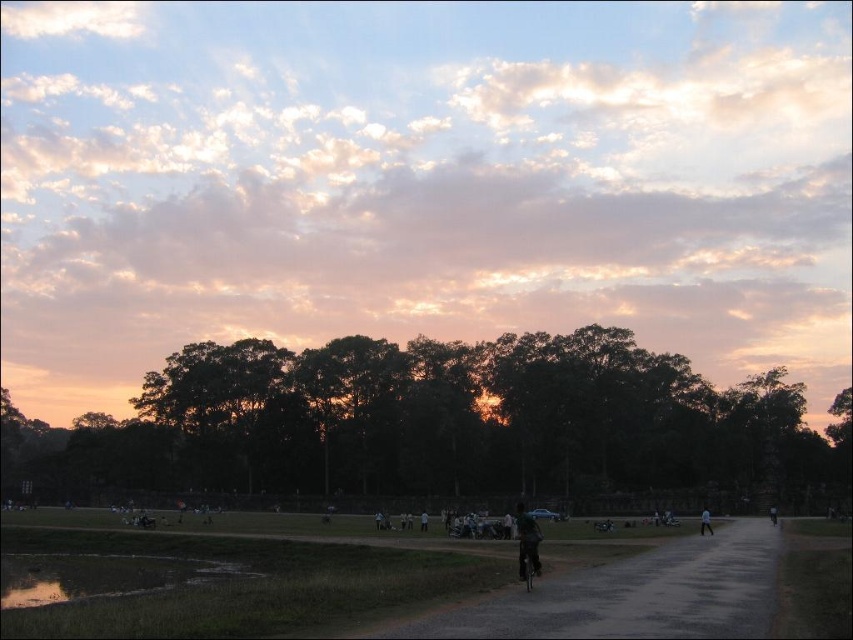
Between point (815, 96) and point (335, 470), which one is positioned behind?

Positioned behind is point (815, 96).

Locate an element on the screen. pink fluffy clouds at upper center is located at coordinates (421, 180).

Which is in front, point (223, 56) or point (747, 444)?

Point (747, 444)

Locate an element on the screen. pink fluffy clouds at upper center is located at coordinates (421, 180).

Is pink fluffy clouds at upper center taller than dark asphalt road at center?

Indeed, pink fluffy clouds at upper center has a greater height compared to dark asphalt road at center.

Does pink fluffy clouds at upper center have a larger size compared to dark asphalt road at center?

Indeed, pink fluffy clouds at upper center has a larger size compared to dark asphalt road at center.

Who is more forward, (457, 305) or (706, 602)?

Positioned in front is point (706, 602).

This screenshot has width=853, height=640. Identify the location of pink fluffy clouds at upper center. (421, 180).

Does point (344, 58) come behind point (529, 570)?

That is True.

Is pink fluffy clouds at upper center below dark blue jeans at center?

Incorrect, pink fluffy clouds at upper center is not positioned below dark blue jeans at center.

Between point (561, 228) and point (515, 508), which one is positioned in front?

Point (515, 508) is more forward.

This screenshot has height=640, width=853. Identify the location of pink fluffy clouds at upper center. (421, 180).